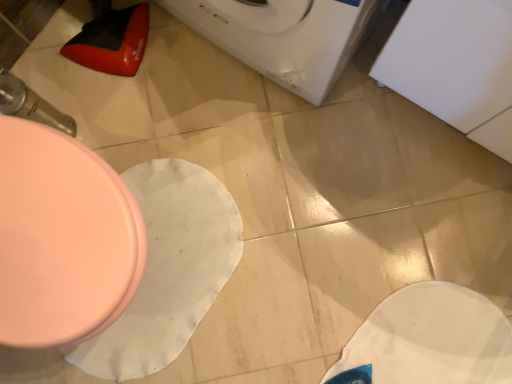
Question: Do you think white glossy washing machine at upper center is within matte pink toilet at left, or outside of it?

Choices:
 (A) outside
 (B) inside

Answer: (A)

Question: Is white glossy washing machine at upper center bigger or smaller than matte pink toilet at left?

Choices:
 (A) big
 (B) small

Answer: (A)

Question: From a real-world perspective, relative to matte pink toilet at left, is white glossy washing machine at upper center vertically above or below?

Choices:
 (A) below
 (B) above

Answer: (B)

Question: Would you say matte pink toilet at left is to the left or to the right of white glossy washing machine at upper center in the picture?

Choices:
 (A) left
 (B) right

Answer: (A)

Question: From the image's perspective, is matte pink toilet at left positioned above or below white glossy washing machine at upper center?

Choices:
 (A) above
 (B) below

Answer: (B)

Question: Do you think matte pink toilet at left is within white glossy washing machine at upper center, or outside of it?

Choices:
 (A) outside
 (B) inside

Answer: (A)

Question: From a real-world perspective, is matte pink toilet at left above or below white glossy washing machine at upper center?

Choices:
 (A) above
 (B) below

Answer: (B)